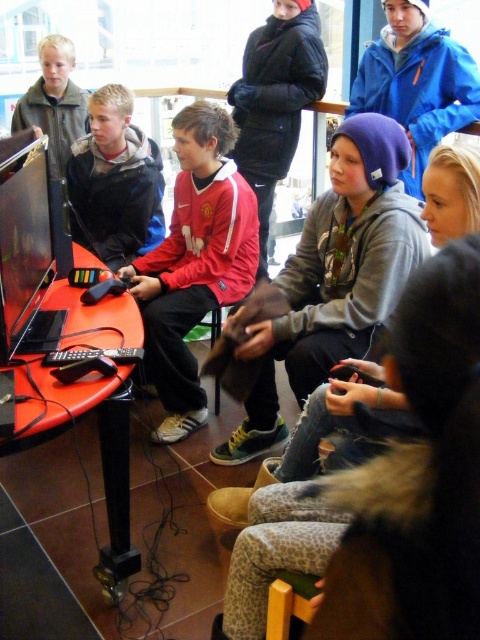
Can you confirm if red jersey at center is thinner than matte black jacket at center?

No, red jersey at center is not thinner than matte black jacket at center.

Who is taller, red jersey at center or matte black jacket at center?

red jersey at center is taller.

The width and height of the screenshot is (480, 640). What do you see at coordinates (194, 260) in the screenshot?
I see `red jersey at center` at bounding box center [194, 260].

The height and width of the screenshot is (640, 480). I want to click on red jersey at center, so click(194, 260).

Between point (400, 4) and point (108, 168), which one is positioned in front?

Positioned in front is point (400, 4).

The width and height of the screenshot is (480, 640). Find the location of `blue fleece jacket at upper center`. blue fleece jacket at upper center is located at coordinates (417, 83).

This screenshot has height=640, width=480. Identify the location of blue fleece jacket at upper center. (417, 83).

Is point (195, 122) farther from camera compared to point (395, 56)?

No.

Does red jersey at center appear on the right side of blue fleece jacket at upper center?

No, red jersey at center is not to the right of blue fleece jacket at upper center.

Image resolution: width=480 pixels, height=640 pixels. What do you see at coordinates (194, 260) in the screenshot?
I see `red jersey at center` at bounding box center [194, 260].

You are a GUI agent. You are given a task and a screenshot of the screen. Output one action in this format:
    pyautogui.click(x=<x>, y=<y>)
    Task: Click on the red jersey at center
    The width and height of the screenshot is (480, 640).
    Given the screenshot: What is the action you would take?
    pyautogui.click(x=194, y=260)